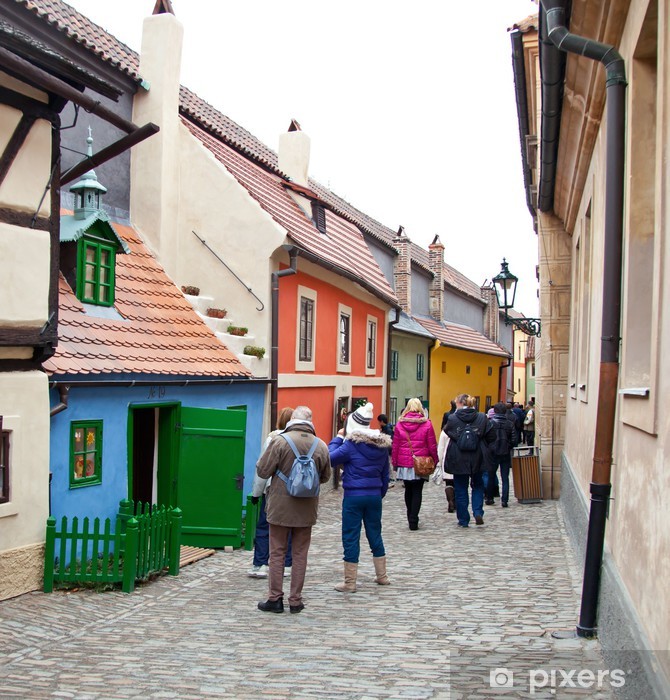
This screenshot has height=700, width=670. In order to click on trashcan in this screenshot , I will do `click(524, 470)`.